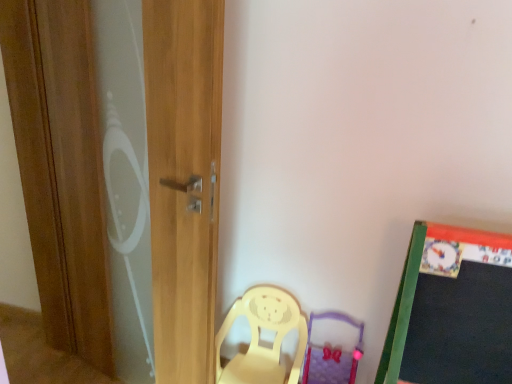
Question: Should I look upward or downward to see purple fabric swivel chair at lower center?

Choices:
 (A) up
 (B) down

Answer: (B)

Question: Would you consider wooden screen door at left to be distant from yellow plastic chair at lower center?

Choices:
 (A) yes
 (B) no

Answer: (B)

Question: From a real-world perspective, does wooden screen door at left stand above yellow plastic chair at lower center?

Choices:
 (A) no
 (B) yes

Answer: (B)

Question: Is wooden screen door at left wider than yellow plastic chair at lower center?

Choices:
 (A) no
 (B) yes

Answer: (A)

Question: Is wooden screen door at left looking in the opposite direction of yellow plastic chair at lower center?

Choices:
 (A) yes
 (B) no

Answer: (A)

Question: Is wooden screen door at left in front of yellow plastic chair at lower center?

Choices:
 (A) yes
 (B) no

Answer: (A)

Question: Is wooden screen door at left oriented towards yellow plastic chair at lower center?

Choices:
 (A) yes
 (B) no

Answer: (B)

Question: Is wooden screen door at left outside purple fabric swivel chair at lower center?

Choices:
 (A) no
 (B) yes

Answer: (B)

Question: Considering the relative sizes of wooden screen door at left and purple fabric swivel chair at lower center in the image provided, is wooden screen door at left shorter than purple fabric swivel chair at lower center?

Choices:
 (A) no
 (B) yes

Answer: (A)

Question: Considering the relative sizes of wooden screen door at left and purple fabric swivel chair at lower center in the image provided, is wooden screen door at left bigger than purple fabric swivel chair at lower center?

Choices:
 (A) yes
 (B) no

Answer: (A)

Question: Is the position of wooden screen door at left more distant than that of purple fabric swivel chair at lower center?

Choices:
 (A) yes
 (B) no

Answer: (B)

Question: Is wooden screen door at left smaller than purple fabric swivel chair at lower center?

Choices:
 (A) yes
 (B) no

Answer: (B)

Question: From the image's perspective, is wooden screen door at left above purple fabric swivel chair at lower center?

Choices:
 (A) yes
 (B) no

Answer: (A)

Question: Is purple fabric swivel chair at lower center at the left side of wooden screen door at left?

Choices:
 (A) yes
 (B) no

Answer: (B)